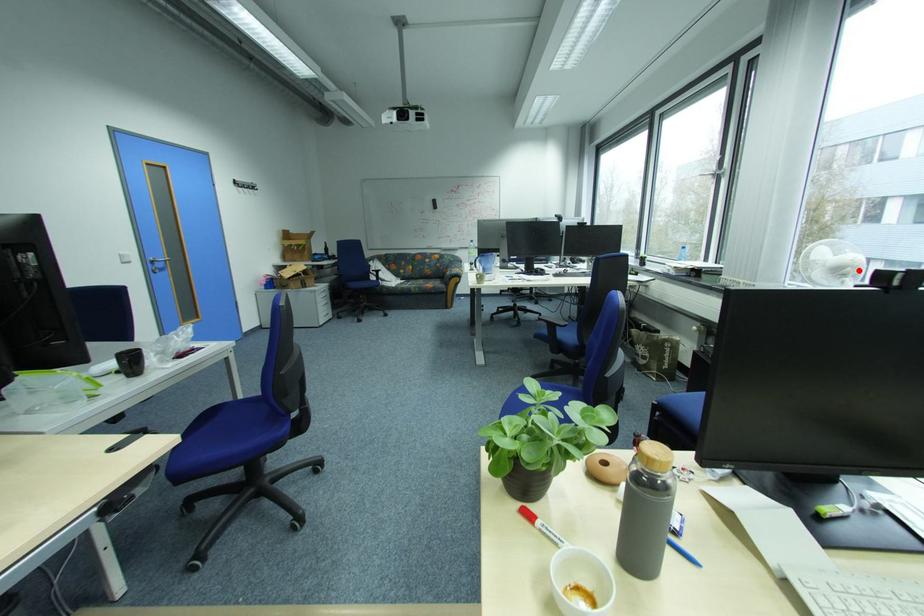
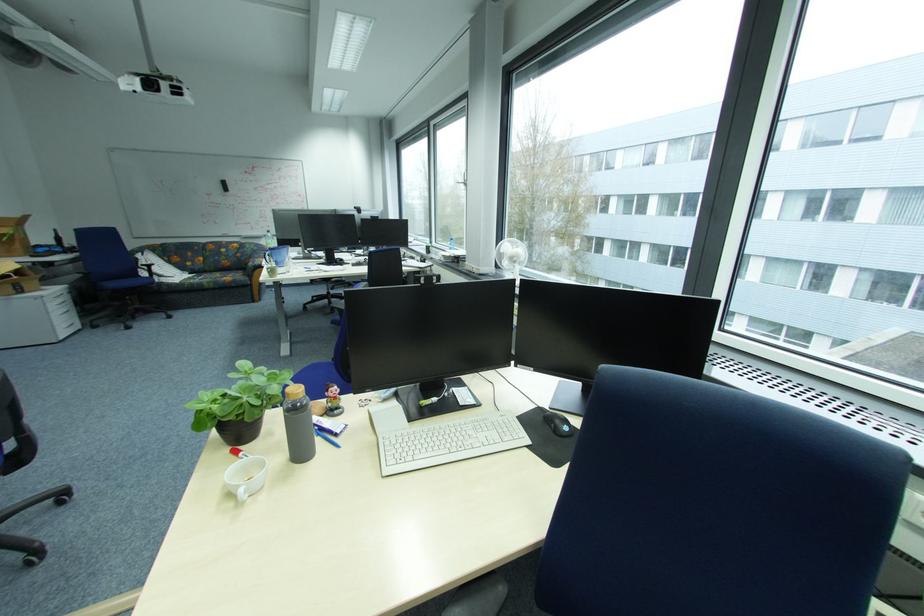
In the second image, find the point that corresponds to the highlighted location in the first image.

(524, 259)